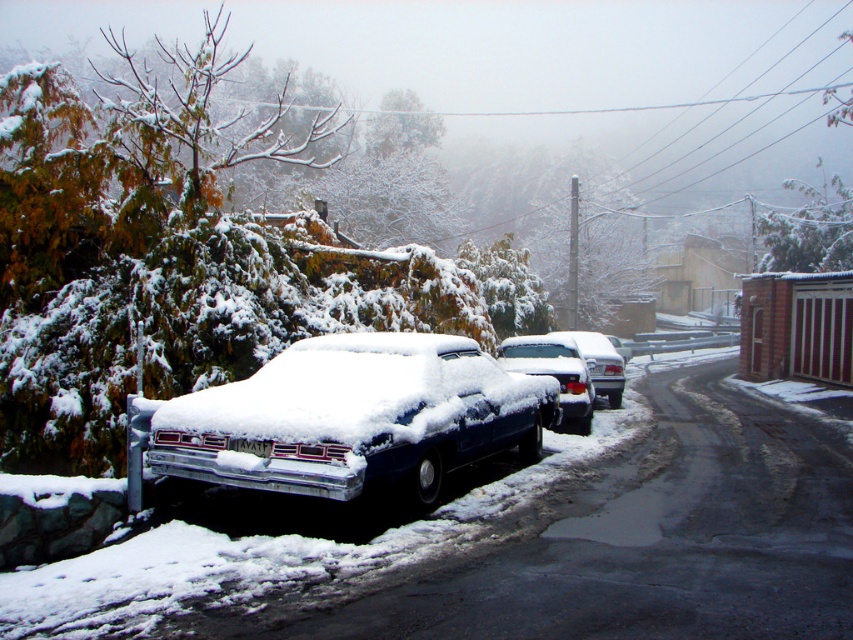
Question: Which of the following is the farthest from the observer?

Choices:
 (A) (x=502, y=356)
 (B) (x=245, y=451)
 (C) (x=383, y=436)
 (D) (x=592, y=333)

Answer: (D)

Question: Can you confirm if sleek metallic car at center is bigger than white plastic license plate at center?

Choices:
 (A) no
 (B) yes

Answer: (B)

Question: Which point is closer to the camera taking this photo?

Choices:
 (A) (579, 352)
 (B) (520, 336)
 (C) (242, 440)
 (D) (311, 353)

Answer: (C)

Question: Is sleek blue car at center positioned before sleek metallic car at center?

Choices:
 (A) no
 (B) yes

Answer: (B)

Question: Which object is closer to the camera taking this photo?

Choices:
 (A) snow-covered sedan at center
 (B) sleek blue car at center
 (C) sleek metallic car at center
 (D) white plastic license plate at center

Answer: (B)

Question: Does sleek blue car at center have a larger size compared to white plastic license plate at center?

Choices:
 (A) no
 (B) yes

Answer: (B)